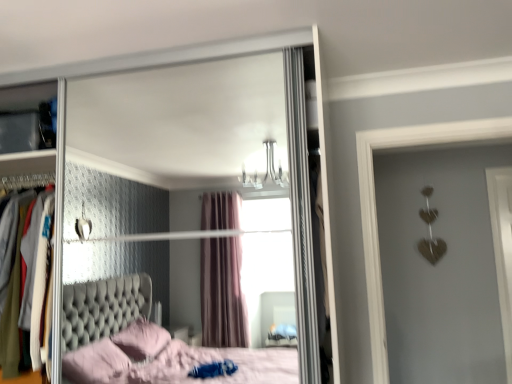
Question: Is metallic silver dresser at left wider or thinner than clear glass mirror at upper center?

Choices:
 (A) thin
 (B) wide

Answer: (A)

Question: From the image's perspective, is metallic silver dresser at left positioned above or below clear glass mirror at upper center?

Choices:
 (A) above
 (B) below

Answer: (B)

Question: Visually, is metallic silver dresser at left positioned to the left or to the right of clear glass mirror at upper center?

Choices:
 (A) right
 (B) left

Answer: (B)

Question: Which is correct: clear glass mirror at upper center is inside metallic silver dresser at left, or outside of it?

Choices:
 (A) inside
 (B) outside

Answer: (B)

Question: From the image's perspective, is clear glass mirror at upper center above or below metallic silver dresser at left?

Choices:
 (A) below
 (B) above

Answer: (B)

Question: From their relative heights in the image, would you say clear glass mirror at upper center is taller or shorter than metallic silver dresser at left?

Choices:
 (A) short
 (B) tall

Answer: (B)

Question: Relative to metallic silver dresser at left, is clear glass mirror at upper center in front or behind?

Choices:
 (A) front
 (B) behind

Answer: (A)